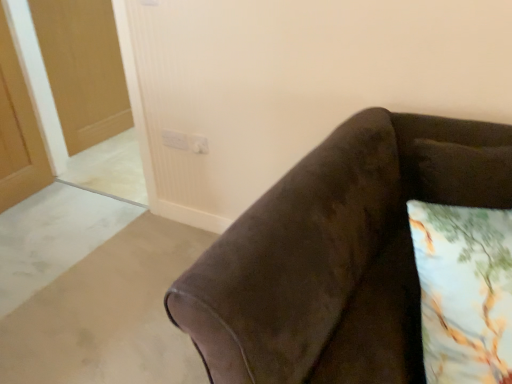
Question: Is white plastic electric outlet at upper center, acting as the second electric outlet starting from the left, facing towards printed fabric pillow at lower right?

Choices:
 (A) no
 (B) yes

Answer: (A)

Question: Does white plastic electric outlet at upper center, arranged as the first electric outlet when viewed from the right, have a greater width compared to printed fabric pillow at lower right?

Choices:
 (A) no
 (B) yes

Answer: (A)

Question: Is white plastic electric outlet at upper center, acting as the second electric outlet starting from the left, thinner than printed fabric pillow at lower right?

Choices:
 (A) no
 (B) yes

Answer: (B)

Question: From the image's perspective, does white plastic electric outlet at upper center, arranged as the first electric outlet when viewed from the right, appear lower than printed fabric pillow at lower right?

Choices:
 (A) no
 (B) yes

Answer: (A)

Question: Considering the relative sizes of white plastic electric outlet at upper center, arranged as the first electric outlet when viewed from the right, and printed fabric pillow at lower right in the image provided, is white plastic electric outlet at upper center, arranged as the first electric outlet when viewed from the right, taller than printed fabric pillow at lower right?

Choices:
 (A) no
 (B) yes

Answer: (A)

Question: Is white plastic electric outlet at upper center, acting as the second electric outlet starting from the left, closer to the viewer compared to printed fabric pillow at lower right?

Choices:
 (A) yes
 (B) no

Answer: (B)

Question: Considering the relative sizes of white plastic electric outlet at upper center, arranged as the first electric outlet when viewed from the right, and matte wooden door at upper left in the image provided, is white plastic electric outlet at upper center, arranged as the first electric outlet when viewed from the right, wider than matte wooden door at upper left?

Choices:
 (A) no
 (B) yes

Answer: (A)

Question: Is white plastic electric outlet at upper center, arranged as the first electric outlet when viewed from the right, oriented away from matte wooden door at upper left?

Choices:
 (A) no
 (B) yes

Answer: (A)

Question: Does white plastic electric outlet at upper center, arranged as the first electric outlet when viewed from the right, touch matte wooden door at upper left?

Choices:
 (A) no
 (B) yes

Answer: (A)

Question: From the image's perspective, is white plastic electric outlet at upper center, acting as the second electric outlet starting from the left, below matte wooden door at upper left?

Choices:
 (A) no
 (B) yes

Answer: (B)

Question: Considering the relative sizes of white plastic electric outlet at upper center, acting as the second electric outlet starting from the left, and matte wooden door at upper left in the image provided, is white plastic electric outlet at upper center, acting as the second electric outlet starting from the left, bigger than matte wooden door at upper left?

Choices:
 (A) yes
 (B) no

Answer: (B)

Question: Is white plastic electric outlet at upper center, arranged as the first electric outlet when viewed from the right, positioned far away from matte wooden door at upper left?

Choices:
 (A) yes
 (B) no

Answer: (A)

Question: Does white plastic electric outlet at upper center, which is counted as the second electric outlet, starting from the right, have a lesser height compared to printed fabric pillow at lower right?

Choices:
 (A) no
 (B) yes

Answer: (B)